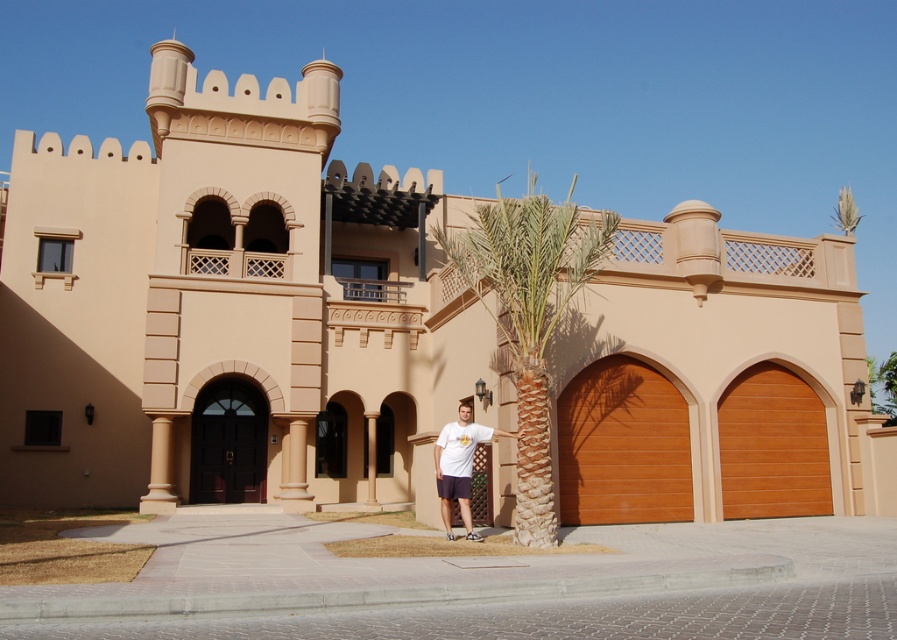
You are standing in front of the two large wooden garage doors on the sides of the entrance. You want to walk straight ahead towards the green leafy palm tree at center. How far will you have to walk?

The green leafy palm tree at center is 11.45 meters from viewer, so you will have to walk 11.45 meters to reach it.